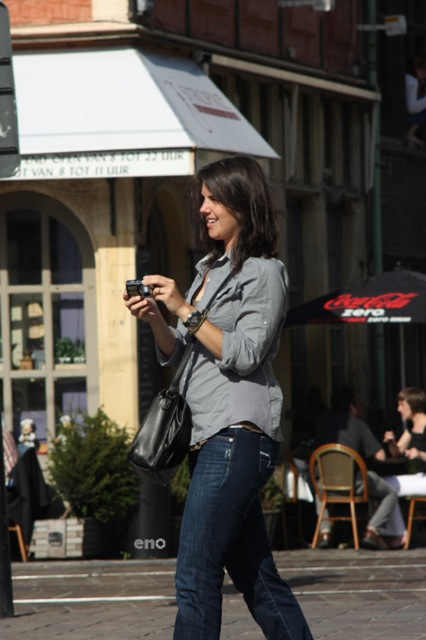
Question: Can you confirm if matte gray shirt at center is positioned to the right of blue denim jeans at lower center?

Choices:
 (A) no
 (B) yes

Answer: (B)

Question: Based on their relative distances, which object is nearer to the dark blue denim jeans at lower center?

Choices:
 (A) blue denim jeans at lower center
 (B) matte gray shirt at center

Answer: (B)

Question: Which of these objects is positioned farthest from the blue denim jeans at lower center?

Choices:
 (A) matte gray shirt at center
 (B) dark blue denim jeans at lower center

Answer: (A)

Question: Which point is closer to the camera?

Choices:
 (A) (184, 544)
 (B) (229, 173)

Answer: (A)

Question: Considering the relative positions of matte gray shirt at center and blue denim jeans at lower center in the image provided, where is matte gray shirt at center located with respect to blue denim jeans at lower center?

Choices:
 (A) below
 (B) above

Answer: (B)

Question: Can you confirm if matte gray shirt at center is positioned above dark blue denim jeans at lower center?

Choices:
 (A) no
 (B) yes

Answer: (B)